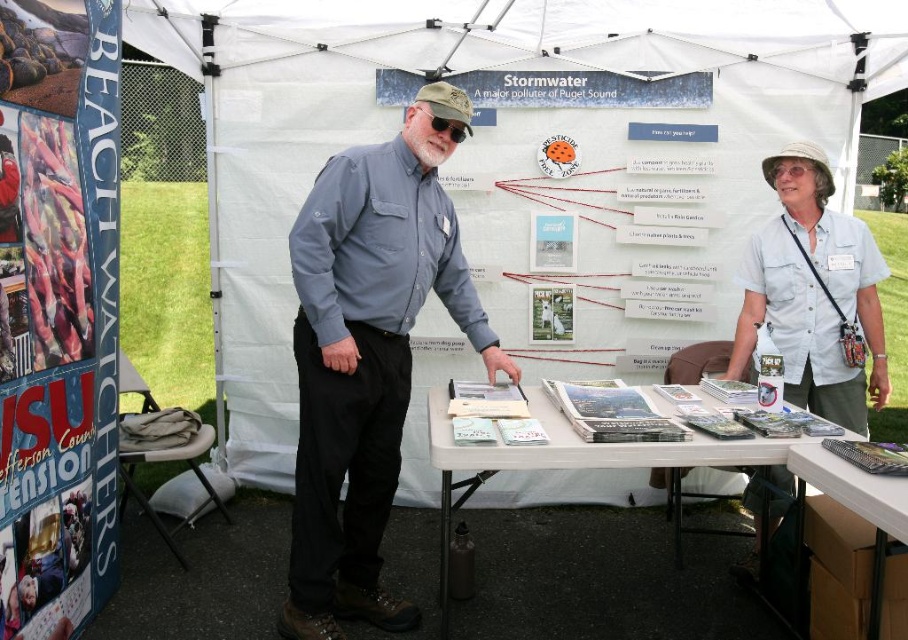
You are a visitor at the event and want to read the information on the blue paper poster at left and the white cotton shirt at upper right. Which one is closer to you?

The blue paper poster at left is closer to you because it is in front of the white cotton shirt at upper right.

You are setting up a booth at an event and need to hang a sign on the matte blue shirt at center and the white paper table at center. Which object can support a heavier sign without bending?

The white paper table at center can support a heavier sign without bending because it is thicker than the matte blue shirt at center.

You are at the event and need to locate the blue paper poster at left. According to the scene description, where would you find it?

The blue paper poster at left is located at point (x=57, y=310).